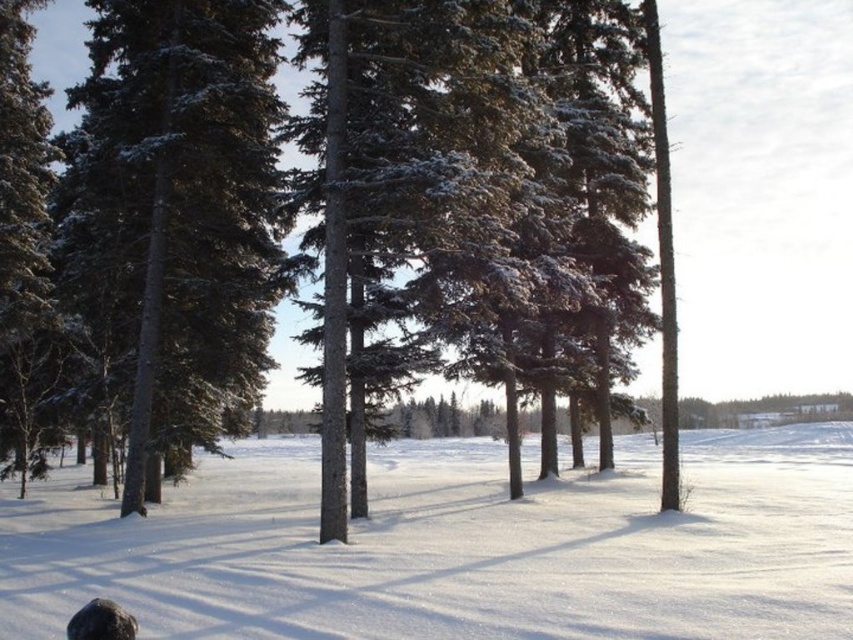
Question: Does white powdery snow at center appear on the right side of green textured pine tree at left?

Choices:
 (A) yes
 (B) no

Answer: (A)

Question: Does white powdery snow at center lie behind green textured pine tree at left?

Choices:
 (A) no
 (B) yes

Answer: (A)

Question: Can you confirm if white powdery snow at center is positioned to the right of green textured pine tree at left?

Choices:
 (A) yes
 (B) no

Answer: (A)

Question: Which point is farther from the camera taking this photo?

Choices:
 (A) (85, 598)
 (B) (254, 35)

Answer: (B)

Question: Which of the following is the farthest from the observer?

Choices:
 (A) (219, 56)
 (B) (671, 612)

Answer: (A)